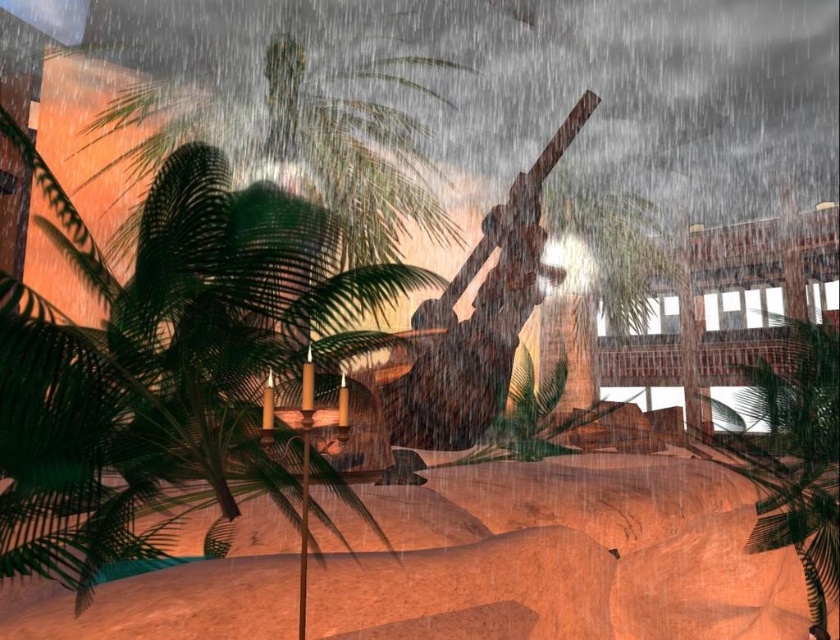
You are standing in the rainstorm scene and want to touch the point at coordinates (798, 456). Which object in the scene will you be touching?

The point at coordinates (798, 456) is located on the green leafy palm tree at right, so touching that point would mean you are touching the green leafy palm tree at right.

You are a photographer trying to capture the palm trees in the storm scene. Given that the green leafy palm tree at right and the green leafy palm tree at center are both in frame, which one would you need to zoom in more on to ensure it fits entirely within your camera viewfinder?

The green leafy palm tree at right is wider than the green leafy palm tree at center, so you would need to zoom in more on the green leafy palm tree at right to ensure it fits within the camera viewfinder.

You are a photographer trying to capture the palm tree and the decorative lamp post in the rainstorm scene. You notice two specific points in your viewfinder labeled as point (833, 365) and point (647, 284). Which point is nearer to your camera lens?

Point (833, 365) is closer to the camera than point (647, 284).